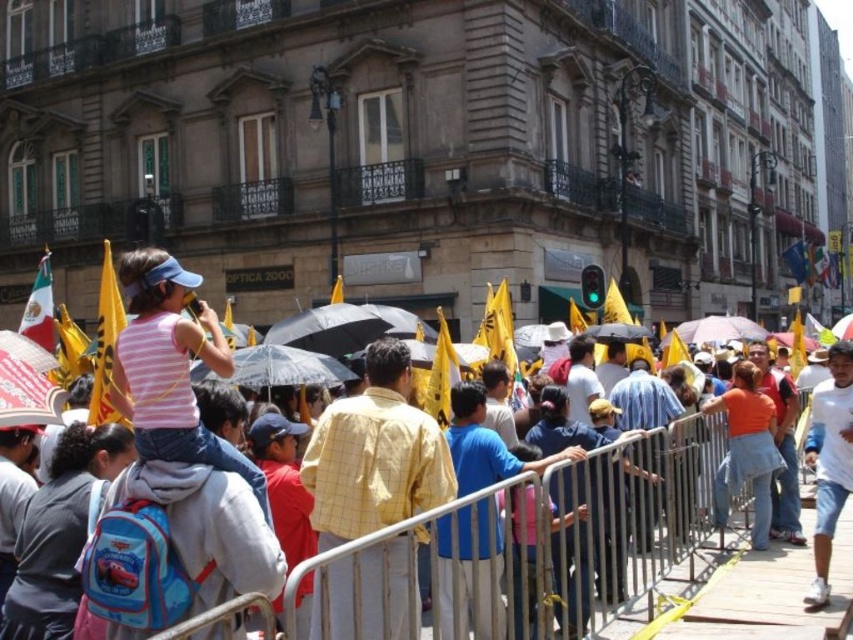
Which is behind, point (589, 532) or point (115, 291)?

Positioned behind is point (115, 291).

Can you confirm if pink striped shirt at center is positioned to the right of yellow fabric flag at upper left?

Yes, pink striped shirt at center is to the right of yellow fabric flag at upper left.

Is point (352, 628) more distant than point (103, 333)?

That is False.

Find the location of `pink striped shirt at center`. pink striped shirt at center is located at coordinates (590, 525).

Who is more forward, [723,440] or [445,410]?

Point [445,410] is more forward.

Can you confirm if pink striped shirt at center is positioned above yellow fabric flag at center?

Incorrect, pink striped shirt at center is not positioned above yellow fabric flag at center.

Is point (636, 596) farther from viewer compared to point (444, 397)?

No, it is in front of (444, 397).

Find the location of `pink striped shirt at center`. pink striped shirt at center is located at coordinates (590, 525).

The image size is (853, 640). What do you see at coordinates (828, 460) in the screenshot? I see `white cotton shirt at right` at bounding box center [828, 460].

Who is higher up, white cotton shirt at right or matte yellow flag at left?

matte yellow flag at left

Who is more distant from viewer, (833, 440) or (38, 292)?

Positioned behind is point (38, 292).

Where is `white cotton shirt at right`? white cotton shirt at right is located at coordinates (828, 460).